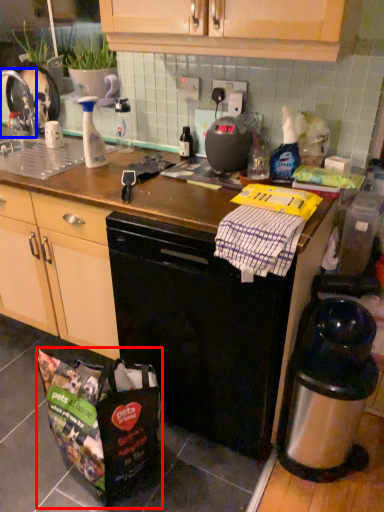
Question: Among these objects, which one is farthest to the camera, bag (highlighted by a red box) or faucet (highlighted by a blue box)?

Choices:
 (A) bag
 (B) faucet

Answer: (B)